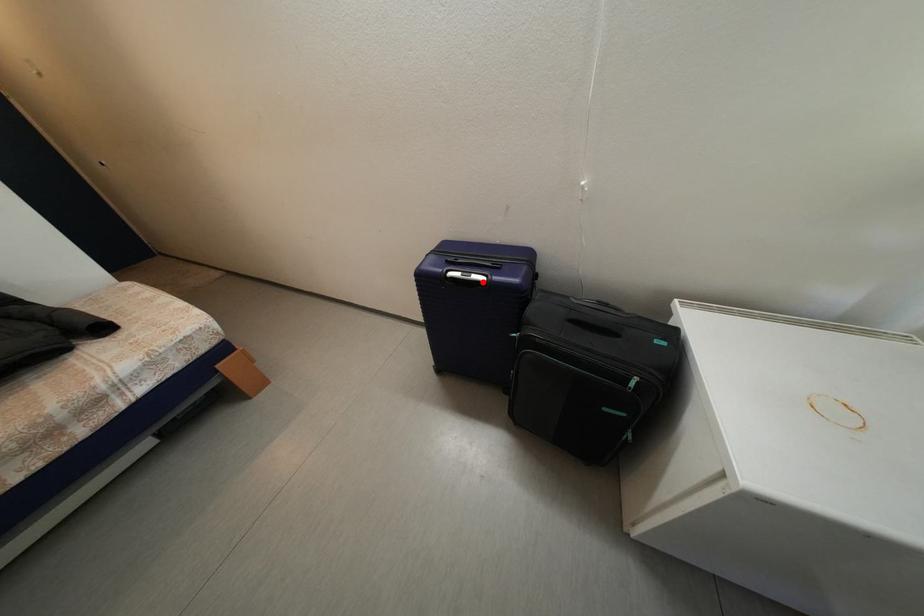
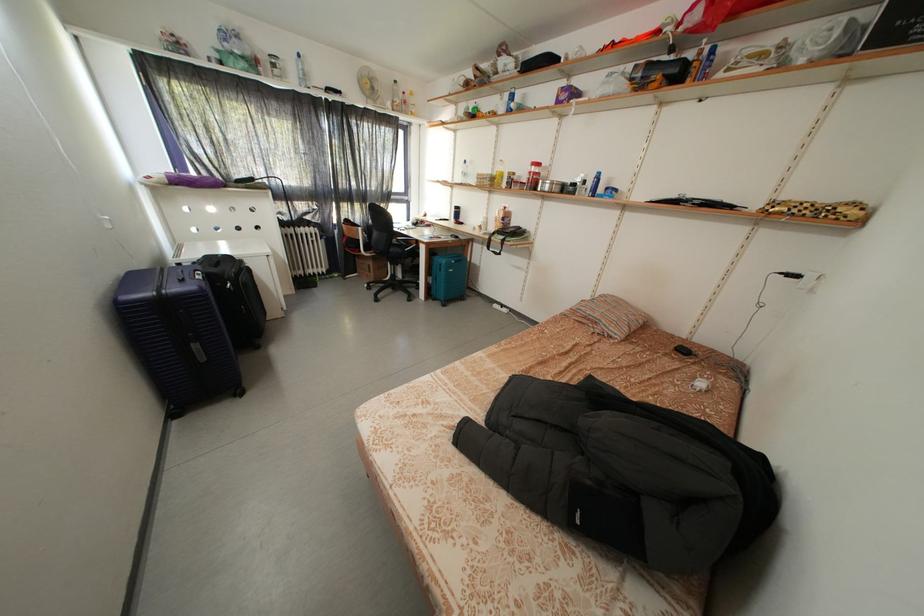
Question: I am providing you with two images of the same scene from different viewpoints. In image1, a red point is highlighted. Considering the same 3D point in image2, which of the following is correct?

Choices:
 (A) It is closer
 (B) It is farther

Answer: (A)